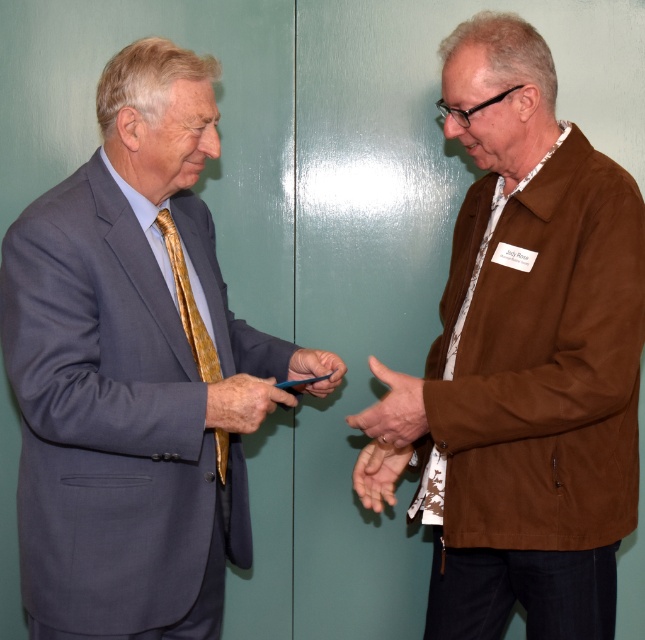
Question: Among these points, which one is farthest from the camera?

Choices:
 (A) (471, 634)
 (B) (392, 412)

Answer: (A)

Question: Does brown suede jacket at right appear on the left side of brown textured tie at right?

Choices:
 (A) yes
 (B) no

Answer: (B)

Question: Is leather textured hand at center to the left of brown textured tie at right from the viewer's perspective?

Choices:
 (A) no
 (B) yes

Answer: (B)

Question: Does blue matte card at center appear on the right side of blue plastic card at center?

Choices:
 (A) no
 (B) yes

Answer: (A)

Question: Which object is farther from the camera taking this photo?

Choices:
 (A) brown textured tie at right
 (B) blue matte card at center

Answer: (A)

Question: Among these objects, which one is farthest from the camera?

Choices:
 (A) blue plastic card at center
 (B) matte gray suit at left
 (C) smooth skin hand at center
 (D) blue matte card at center

Answer: (C)